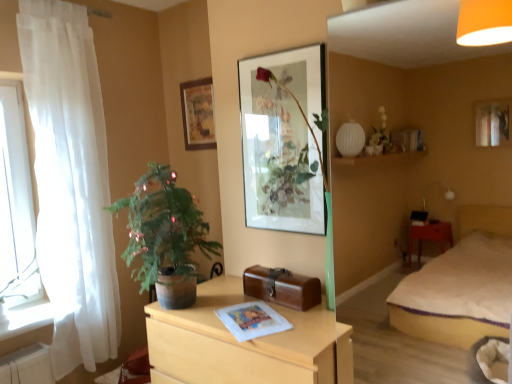
The height and width of the screenshot is (384, 512). In order to click on free location above wooden chest of drawers at center (from a real-world perspective) in this screenshot , I will do `click(260, 314)`.